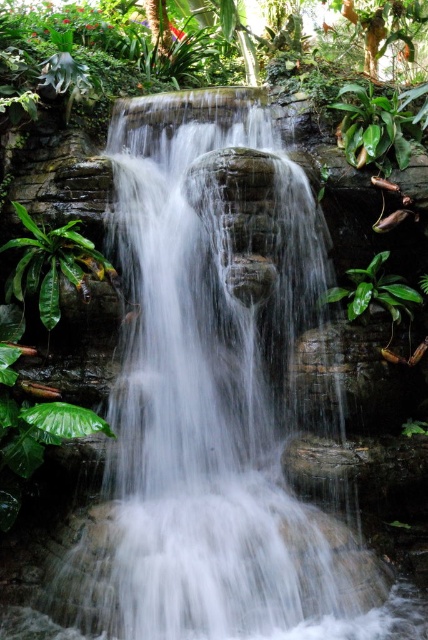
You are standing at the origin point of the image. Which direction should you move to reach the green leafy plant at left?

The green leafy plant at left is located at the 2D coordinates of point (51, 264), so you should move towards the left and slightly downward from your current position at the origin point.

You are standing in front of the waterfall and see the green leafy plant at left and the green glossy leaf at center right. Which one is positioned further to the left side of the scene?

The green leafy plant at left is positioned further to the left side of the scene than the green glossy leaf at center right.

You are a gardener who wants to place a new small statue between the green leafy plant at left and the green glossy leaf at center right. Since the statue is 30 cm wide, will there be enough space between them?

The green leafy plant at left is larger in size than green glossy leaf at center right, but the exact distance between them isn not specified. Therefore, it is uncertain if the 30 cm wide statue will fit without more information about the spacing between the two plants.